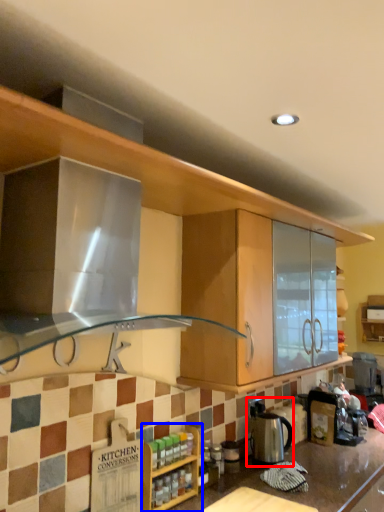
Question: Among these objects, which one is farthest to the camera, appliance (highlighted by a red box) or cabinetry (highlighted by a blue box)?

Choices:
 (A) appliance
 (B) cabinetry

Answer: (A)